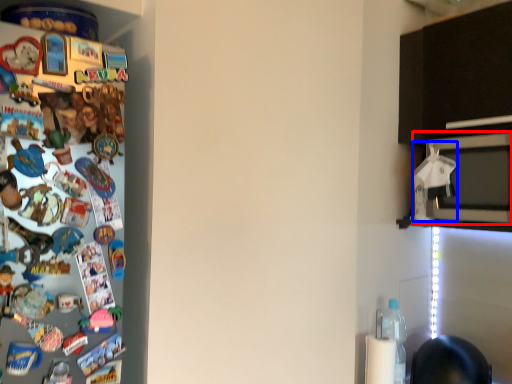
Question: Which of the following is the farthest to the observer, microwave oven (highlighted by a red box) or toy (highlighted by a blue box)?

Choices:
 (A) microwave oven
 (B) toy

Answer: (B)